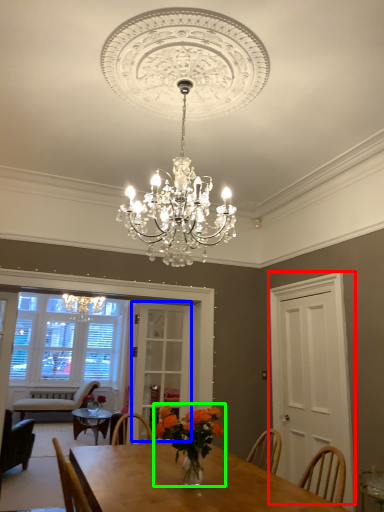
Question: Estimate the real-world distances between objects in this image. Which object is closer to glass door (highlighted by a red box), glass door (highlighted by a blue box) or floral arrangement (highlighted by a green box)?

Choices:
 (A) glass door
 (B) floral arrangement

Answer: (A)